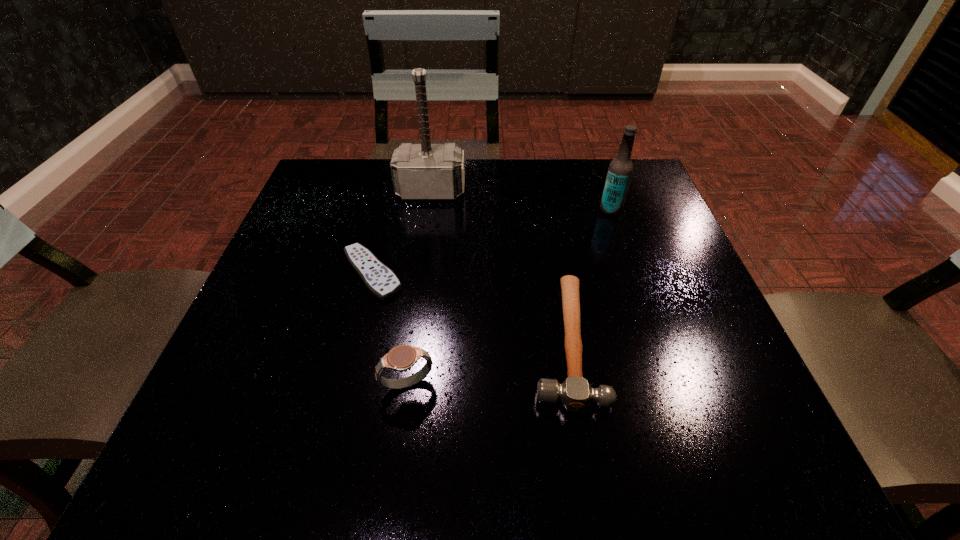
At what (x,y) coordinates should I click in order to perform the action: click on vacant region located 0.280m on the label of the beer bottle. Please return your answer as a coordinate pair (x, y). Image resolution: width=960 pixels, height=540 pixels. Looking at the image, I should click on (478, 210).

This screenshot has height=540, width=960. I want to click on free spot located 0.200m on the label of the beer bottle, so click(x=513, y=210).

This screenshot has height=540, width=960. I want to click on vacant space located on the front of the third tallest object, so click(396, 472).

Where is `free space located 0.170m on the back of the nearer hammer`? The width and height of the screenshot is (960, 540). free space located 0.170m on the back of the nearer hammer is located at coordinates (545, 228).

Where is `free space located on the front of the shortest object`? free space located on the front of the shortest object is located at coordinates pos(336,418).

Where is `hammer at the far edge`? The image size is (960, 540). hammer at the far edge is located at coordinates (425, 171).

Find the location of `beer bottle that is positioned at the far edge`. beer bottle that is positioned at the far edge is located at coordinates (620, 170).

The width and height of the screenshot is (960, 540). I want to click on object present at the left edge, so click(x=379, y=279).

Find the location of `object at the right edge`. object at the right edge is located at coordinates (620, 170).

This screenshot has width=960, height=540. What are the coordinates of `object located in the far right corner section of the desktop` in the screenshot? It's located at (620, 170).